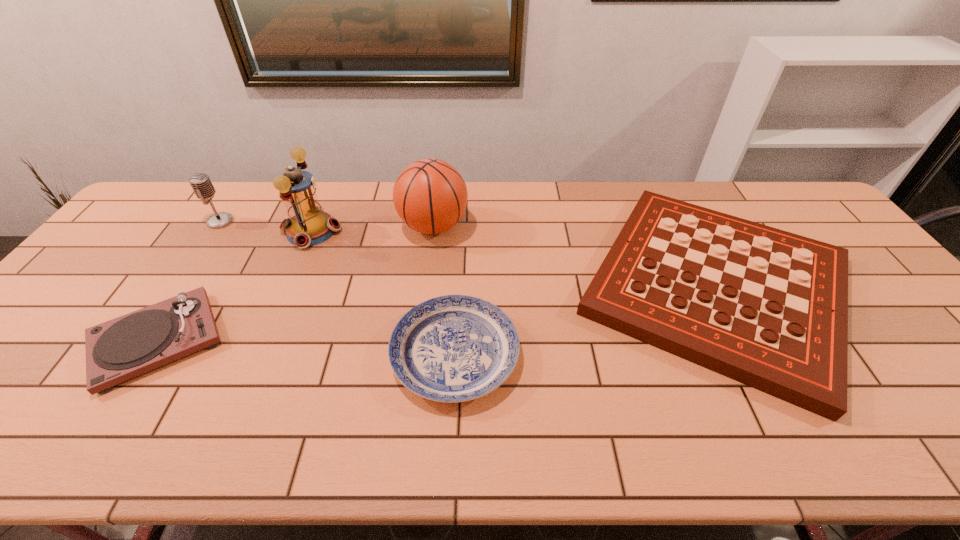
Where is `vacant region between the fourth object from right to left and the third tallest object`? This screenshot has width=960, height=540. vacant region between the fourth object from right to left and the third tallest object is located at coordinates (266, 226).

Where is `free space between the phonograph_record and the microphone`? free space between the phonograph_record and the microphone is located at coordinates (189, 281).

This screenshot has width=960, height=540. In order to click on free space that is in between the shortest object and the fourth object from right to left in this screenshot , I will do `click(383, 293)`.

Where is `vacant area that lies between the plate and the microphone`? vacant area that lies between the plate and the microphone is located at coordinates (338, 288).

Identify which object is the second nearest to the fourth shortest object. Please provide its 2D coordinates. Your answer should be formatted as a tuple, i.e. [(x, y)], where the tuple contains the x and y coordinates of a point satisfying the conditions above.

[(117, 350)]

The width and height of the screenshot is (960, 540). Identify the location of object that stands as the closest to the phonograph_record. (308, 225).

At what (x,y) coordinates should I click in order to perform the action: click on free point that satisfies the following two spatial constraints: 1. on the front-facing side of the shortest object; 2. on the left side of the lantern. Please return your answer as a coordinate pair (x, y). Looking at the image, I should click on (259, 354).

Identify the location of free location that satisfies the following two spatial constraints: 1. on the back side of the plate; 2. on the front-facing side of the lantern. The height and width of the screenshot is (540, 960). (461, 231).

At what (x,y) coordinates should I click in order to perform the action: click on free point that satisfies the following two spatial constraints: 1. on the front-facing side of the plate; 2. on the right side of the lantern. Please return your answer as a coordinate pair (x, y). The height and width of the screenshot is (540, 960). Looking at the image, I should click on (259, 354).